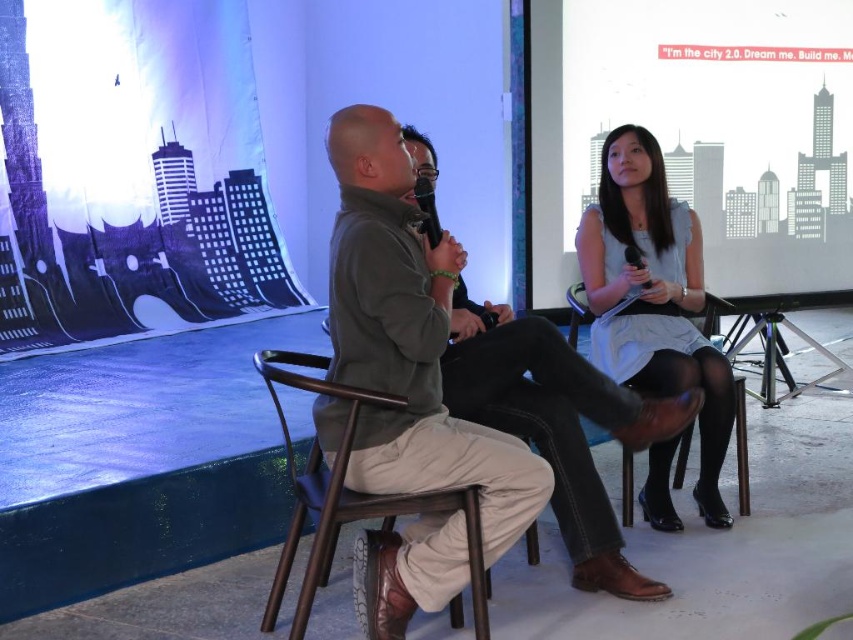
Question: Does white matte projection screen at upper center have a smaller size compared to matte gray shirt at center?

Choices:
 (A) no
 (B) yes

Answer: (A)

Question: Which object is farther from the camera taking this photo?

Choices:
 (A) brown wood chair at center
 (B) white satin dress at right
 (C) white matte projection screen at upper center
 (D) khaki cotton pants at center

Answer: (C)

Question: Is white satin dress at right closer to the viewer compared to khaki cotton pants at center?

Choices:
 (A) no
 (B) yes

Answer: (A)

Question: Which point appears farthest from the camera in this image?

Choices:
 (A) (471, 560)
 (B) (465, 476)
 (C) (772, 285)
 (D) (721, 444)

Answer: (C)

Question: Does white matte projection screen at upper center have a smaller size compared to white satin dress at right?

Choices:
 (A) no
 (B) yes

Answer: (A)

Question: Which of the following is the closest to the observer?

Choices:
 (A) (460, 563)
 (B) (561, 472)

Answer: (A)